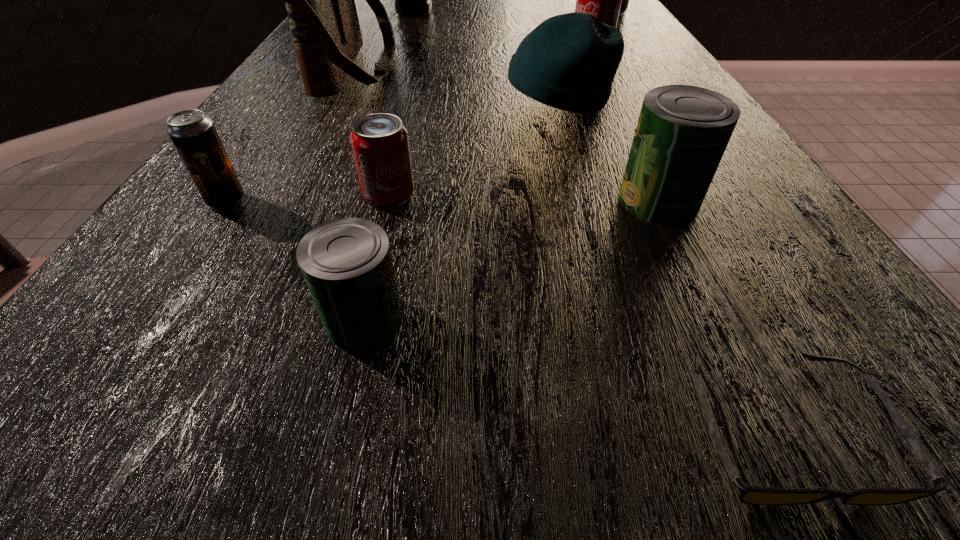
Where is `free location located on the back of the beanie`? The height and width of the screenshot is (540, 960). free location located on the back of the beanie is located at coordinates (545, 51).

The width and height of the screenshot is (960, 540). Identify the location of vacant space situated 0.270m on the front of the second smallest red can. (620, 104).

The height and width of the screenshot is (540, 960). Identify the location of free space located on the front of the farther green can. (802, 505).

At what (x,y) coordinates should I click in order to perform the action: click on free space located 0.190m on the right of the black beer can. Please return your answer as a coordinate pair (x, y). This screenshot has width=960, height=540. Looking at the image, I should click on (377, 201).

The image size is (960, 540). What are the coordinates of `vacant region located on the right of the smaller green can` in the screenshot? It's located at (485, 319).

At what (x,y) coordinates should I click in order to perform the action: click on free space located 0.290m on the front of the nearest red can. Please return your answer as a coordinate pair (x, y). This screenshot has width=960, height=540. Looking at the image, I should click on (340, 397).

The width and height of the screenshot is (960, 540). Identify the location of liquor located in the far edge section of the desktop. (410, 0).

Where is `can present at the far edge`? can present at the far edge is located at coordinates (625, 0).

The width and height of the screenshot is (960, 540). In order to click on object that is positioned at the near edge in this screenshot , I will do `click(749, 494)`.

Identify the location of shoulder bag that is positioned at the left edge. The image size is (960, 540). (319, 0).